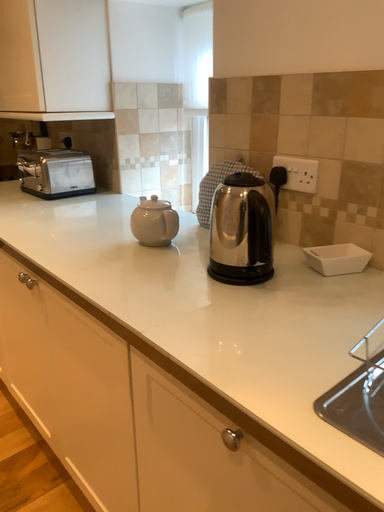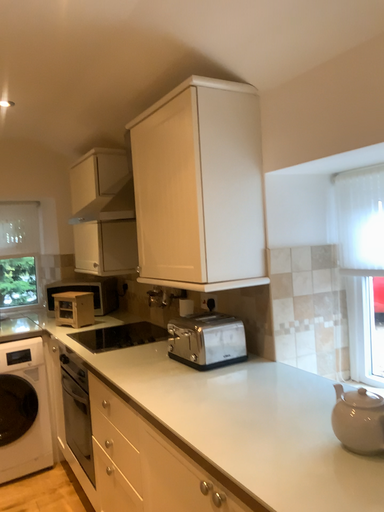
Question: How did the camera likely rotate when shooting the video?

Choices:
 (A) rotated left
 (B) rotated right

Answer: (A)